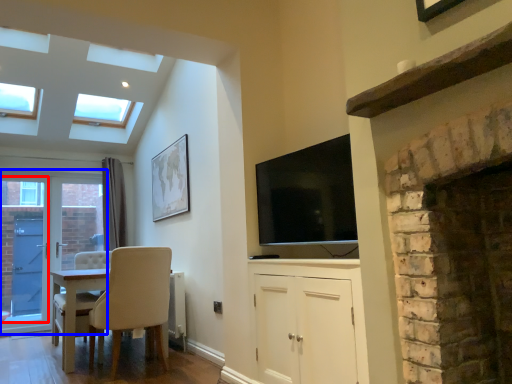
Question: Which object appears closest to the camera in this image, glass door (highlighted by a red box) or door (highlighted by a blue box)?

Choices:
 (A) glass door
 (B) door

Answer: (A)